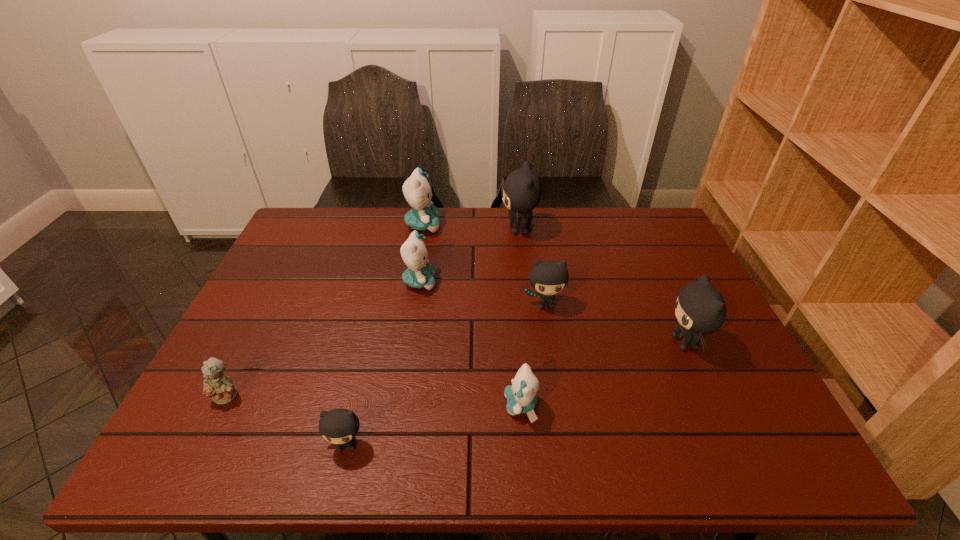
You are a GUI agent. You are given a task and a screenshot of the screen. Output one action in this format:
    pyautogui.click(x=<x>, y=<y>)
    Task: Click on the free space located 0.340m on the front-facing side of the second smallest gray kitten
    The image size is (960, 540).
    Given the screenshot: What is the action you would take?
    pyautogui.click(x=565, y=431)

You are a GUI agent. You are given a task and a screenshot of the screen. Output one action in this format:
    pyautogui.click(x=<x>, y=<y>)
    Task: Click on the free space located on the face of the nearest blue kitten
    
    Given the screenshot: What is the action you would take?
    pyautogui.click(x=341, y=406)

At what (x,y) coordinates should I click in order to perform the action: click on vacant area situated on the face of the nearest blue kitten. Please return your answer as a coordinate pair (x, y). The image size is (960, 540). Looking at the image, I should click on (409, 406).

Where is `free region located on the face of the nearest blue kitten`? free region located on the face of the nearest blue kitten is located at coordinates (472, 406).

The height and width of the screenshot is (540, 960). I want to click on vacant space situated 0.080m on the front-facing side of the leftmost object, so pos(205,440).

The width and height of the screenshot is (960, 540). Find the location of `object at the near edge`. object at the near edge is located at coordinates (339, 426).

I want to click on object present at the left edge, so click(x=219, y=387).

Where is `object positioned at the right edge`? object positioned at the right edge is located at coordinates (700, 309).

The height and width of the screenshot is (540, 960). Find the location of `vacant area at the far edge of the desktop`. vacant area at the far edge of the desktop is located at coordinates (398, 228).

The width and height of the screenshot is (960, 540). In the image, there is a desktop. In order to click on vacant space at the left edge in this screenshot , I will do `click(296, 252)`.